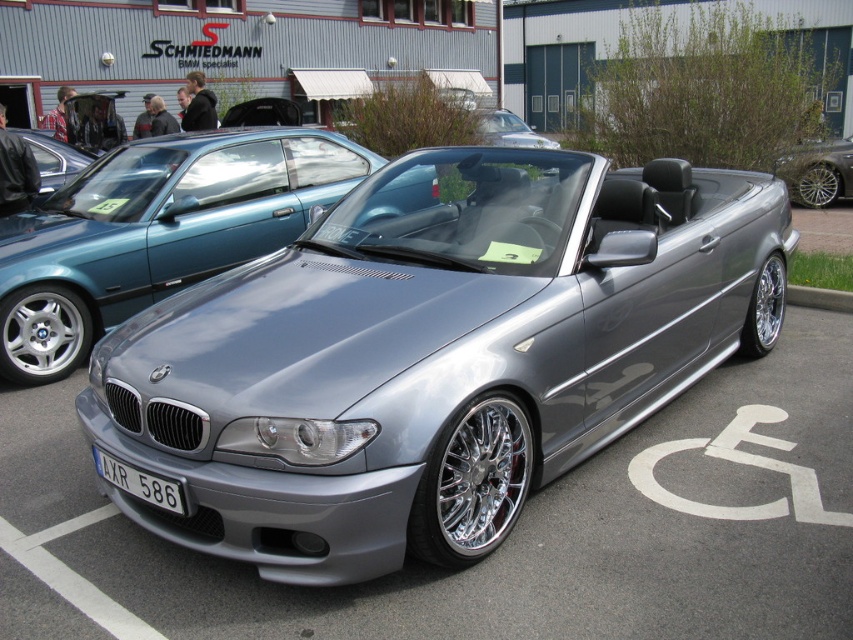
You are a customer at the Schmiedmann BMW Specialist dealership. You want to locate the white plastic license plate at lower center to check the price. Since the satin silver convertible at center is blocking the view, can you determine the direction you should move to get a clear view of the license plate?

The satin silver convertible at center is positioned on the left side of the white plastic license plate at lower center. To get a clear view of the license plate, you should move to the right side of the convertible.

Based on the photo, you are a car salesperson trying to explain the size difference between the silver metallic car at right and the white plastic license plate at lower center to a customer. How would you describe their sizes?

The silver metallic car at right is significantly larger than the white plastic license plate at lower center, which is a standard size for vehicle plates.

You are a delivery person standing at the entrance of the Schmiedmann BMW Specialist dealership. You need to deliver a package to the silver metallic car at right. The delivery robot you are using has a maximum delivery range of 10 meters. Can the robot reach the car?

The silver metallic car at right is 8.64 meters away from the viewer. Since the delivery robot has a maximum range of 10 meters, it can successfully deliver the package to the silver metallic car at right as the distance is within its capability.